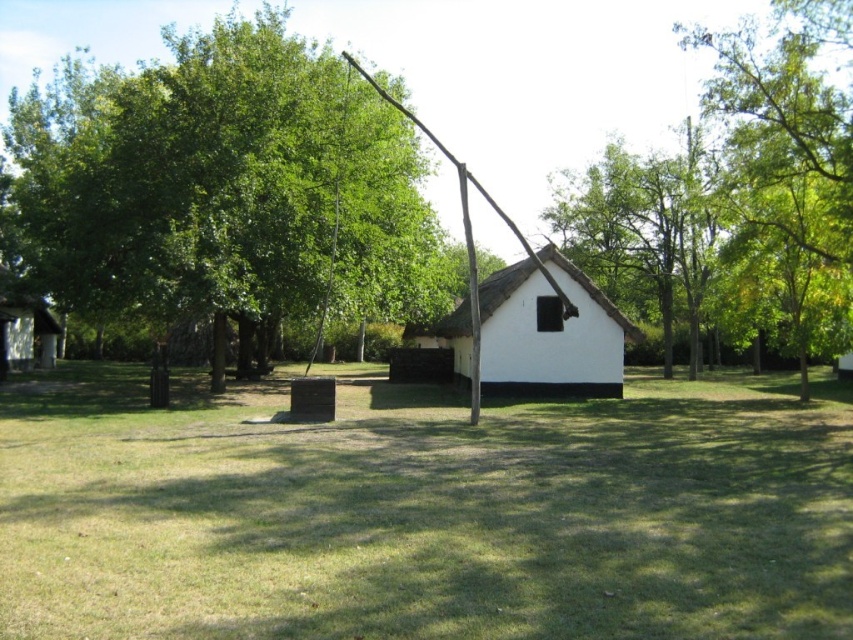
Can you confirm if green leafy tree at upper right is taller than wooden hut at lower left?

Yes, green leafy tree at upper right is taller than wooden hut at lower left.

Which is above, green leafy tree at upper right or wooden hut at lower left?

green leafy tree at upper right is higher up.

Where is `green leafy tree at upper right`? green leafy tree at upper right is located at coordinates (787, 122).

Find the location of a particular element. The image size is (853, 640). green leafy tree at upper right is located at coordinates (787, 122).

Between point (280, 193) and point (532, 333), which one is positioned behind?

Positioned behind is point (532, 333).

Is green leafy tree at upper left above white thatch hut at center?

Yes.

What do you see at coordinates (223, 184) in the screenshot? The image size is (853, 640). I see `green leafy tree at upper left` at bounding box center [223, 184].

Where is `green leafy tree at upper left`? The image size is (853, 640). green leafy tree at upper left is located at coordinates (223, 184).

Is green leafy tree at upper center wider than white thatch hut at center?

Indeed, green leafy tree at upper center has a greater width compared to white thatch hut at center.

Who is positioned more to the right, green leafy tree at upper center or white thatch hut at center?

green leafy tree at upper center

Where is `green leafy tree at upper center`? green leafy tree at upper center is located at coordinates (642, 230).